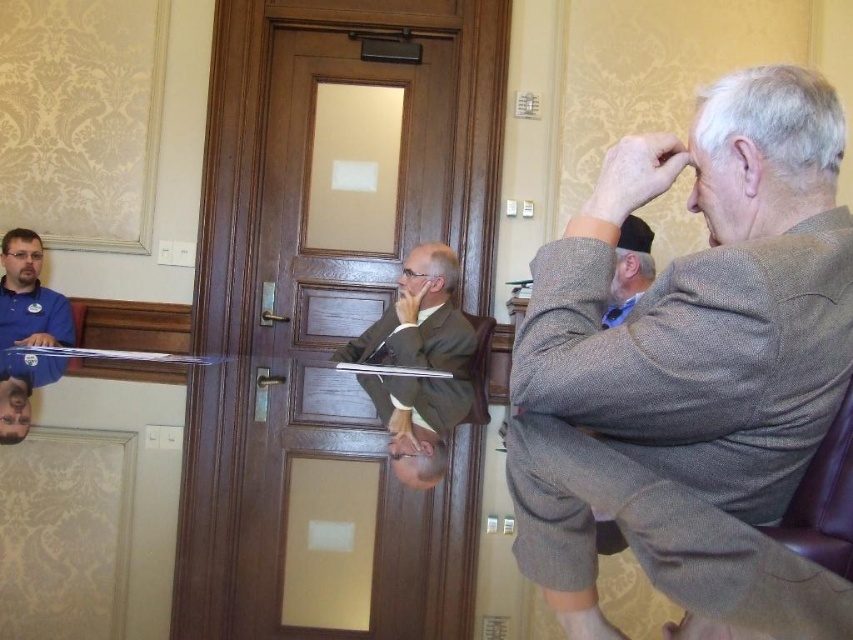
You are an interior designer assessing the layout of this room. The wooden door at center and the matte brown suit at center are both in the central area. Which object is closer to the viewer?

The wooden door at center is positioned under the matte brown suit at center, meaning the matte brown suit at center is closer to the viewer.

You are an interior designer assessing the decor of the room. You notice the brown woolen suit at upper right and the blue fabric cap at upper right. Which object is positioned lower in the image?

The brown woolen suit at upper right is located below the blue fabric cap at upper right, so it is positioned lower in the image.